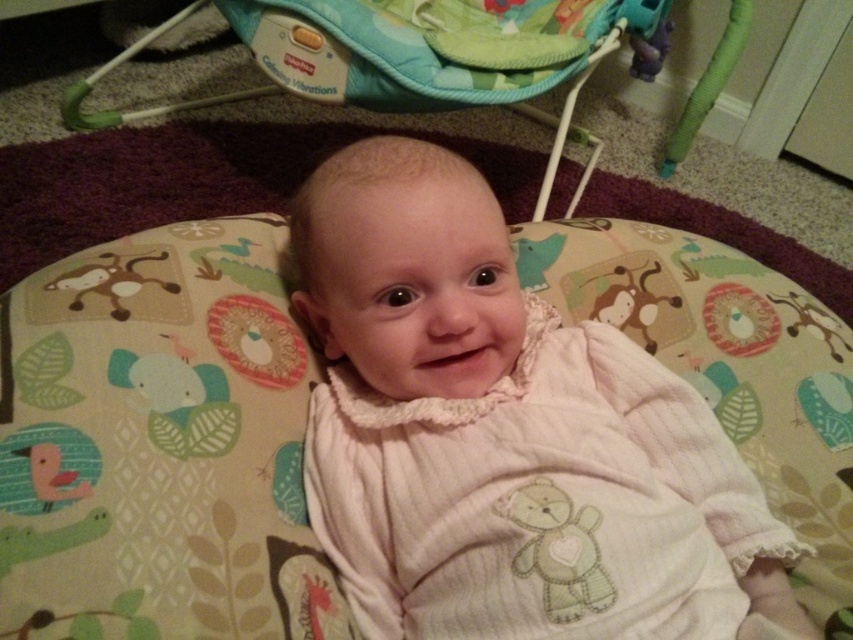
How far apart are white soft fabric baby at center and teal fabric baby swing at upper center?

white soft fabric baby at center is 30.52 inches away from teal fabric baby swing at upper center.

Which of these two, white soft fabric baby at center or teal fabric baby swing at upper center, stands taller?

Standing taller between the two is teal fabric baby swing at upper center.

Does point (426, 456) lie behind point (730, 38)?

That is False.

Where is `white soft fabric baby at center`? This screenshot has width=853, height=640. white soft fabric baby at center is located at coordinates (506, 435).

Does white soft fabric baby at center lie behind green plastic baby swing at upper center?

No.

Is point (369, 140) more distant than point (639, 72)?

That is False.

Where is `white soft fabric baby at center`? This screenshot has height=640, width=853. white soft fabric baby at center is located at coordinates (506, 435).

Does teal fabric baby swing at upper center lie in front of green plastic baby swing at upper center?

Yes, it is in front of green plastic baby swing at upper center.

Is teal fabric baby swing at upper center to the left of green plastic baby swing at upper center from the viewer's perspective?

Correct, you'll find teal fabric baby swing at upper center to the left of green plastic baby swing at upper center.

Between point (479, 17) and point (664, 52), which one is positioned behind?

Point (664, 52)

Find the location of `teal fabric baby swing at upper center`. teal fabric baby swing at upper center is located at coordinates (409, 58).